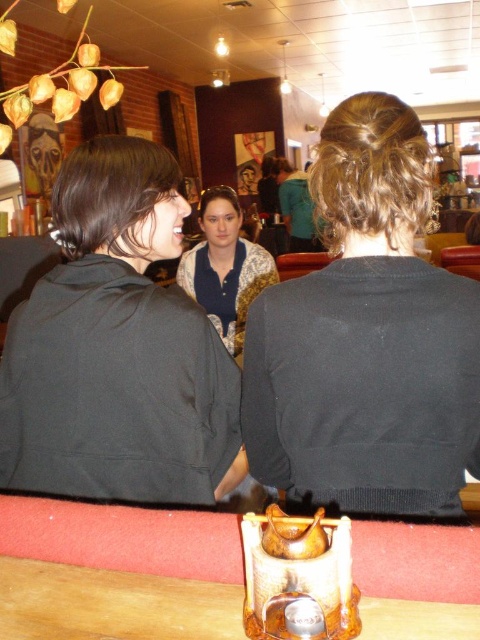
Is black matte hair at center bigger than matte black hoodie at center?

Yes.

Who is higher up, black matte hair at center or matte black hoodie at center?

black matte hair at center is higher up.

Locate an element on the screen. Image resolution: width=480 pixels, height=640 pixels. black matte hair at center is located at coordinates (367, 339).

Locate an element on the screen. This screenshot has width=480, height=640. black matte hair at center is located at coordinates (367, 339).

Does black matte hair at center lie behind blue textured blouse at center?

No, black matte hair at center is in front of blue textured blouse at center.

Who is taller, black matte hair at center or blue textured blouse at center?

blue textured blouse at center is taller.

Is point (478, 340) positioned behind point (211, 278)?

No, (478, 340) is in front of (211, 278).

At what (x,y) coordinates should I click in order to perform the action: click on black matte hair at center. Please return your answer as a coordinate pair (x, y). The height and width of the screenshot is (640, 480). Looking at the image, I should click on (367, 339).

Identify the location of matte black hoodie at center. The height and width of the screenshot is (640, 480). (118, 348).

Looking at this image, between matte black hoodie at center and brown leather table at lower center, which one is positioned lower?

brown leather table at lower center is lower down.

You are a GUI agent. You are given a task and a screenshot of the screen. Output one action in this format:
    pyautogui.click(x=<x>, y=<y>)
    Task: Click on the matte black hoodie at center
    The width and height of the screenshot is (480, 640).
    Given the screenshot: What is the action you would take?
    pyautogui.click(x=118, y=348)

I want to click on matte black hoodie at center, so click(118, 348).